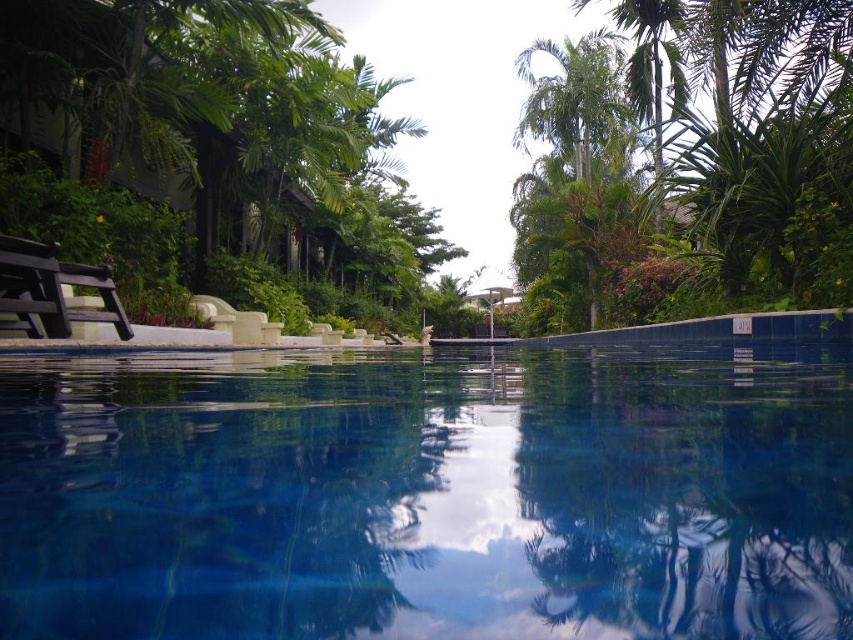
Question: Observing the image, what is the correct spatial positioning of blue tile swimming pool at center in reference to dark brown wooden chair at left?

Choices:
 (A) right
 (B) left

Answer: (A)

Question: Can you confirm if blue tile swimming pool at center is bigger than dark brown wooden chair at left?

Choices:
 (A) yes
 (B) no

Answer: (A)

Question: Is green leafy palm tree at center below dark brown wooden chair at left?

Choices:
 (A) no
 (B) yes

Answer: (A)

Question: Based on their relative distances, which object is nearer to the green leafy tree at left?

Choices:
 (A) dark brown wooden chair at left
 (B) green leafy palm tree at center
 (C) blue tile swimming pool at center

Answer: (B)

Question: Among these points, which one is farthest from the camera?

Choices:
 (A) (215, 154)
 (B) (585, 74)
 (C) (585, 508)

Answer: (B)

Question: Which point is farther from the camera taking this photo?

Choices:
 (A) (582, 435)
 (B) (22, 264)

Answer: (B)